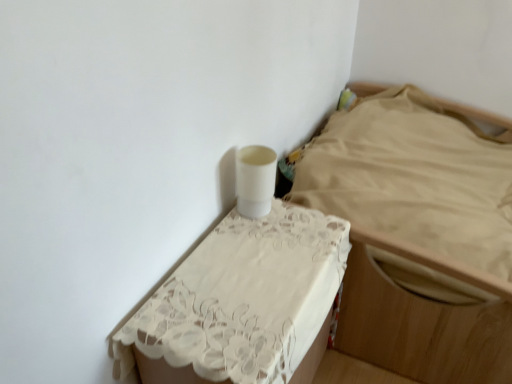
Question: Can you see white glossy nightstand at upper right, acting as the second furniture starting from the left, touching white lace tablecloth at upper center, which is counted as the 2th furniture, starting from the right?

Choices:
 (A) yes
 (B) no

Answer: (B)

Question: Does white glossy nightstand at upper right, acting as the second furniture starting from the left, have a smaller size compared to white lace tablecloth at upper center, positioned as the first furniture in left-to-right order?

Choices:
 (A) yes
 (B) no

Answer: (B)

Question: Does white glossy nightstand at upper right, acting as the second furniture starting from the left, have a lesser width compared to white lace tablecloth at upper center, positioned as the first furniture in left-to-right order?

Choices:
 (A) no
 (B) yes

Answer: (A)

Question: Is white lace tablecloth at upper center, positioned as the first furniture in left-to-right order, located within white glossy nightstand at upper right, acting as the second furniture starting from the left?

Choices:
 (A) yes
 (B) no

Answer: (B)

Question: Is white glossy nightstand at upper right, the first furniture viewed from the right, positioned in front of white lace tablecloth at upper center, which is counted as the 2th furniture, starting from the right?

Choices:
 (A) yes
 (B) no

Answer: (B)

Question: Is white glossy nightstand at upper right, acting as the second furniture starting from the left, behind white lace tablecloth at upper center, which is counted as the 2th furniture, starting from the right?

Choices:
 (A) yes
 (B) no

Answer: (A)

Question: Can you confirm if white lace tablecloth at upper center, which is counted as the 2th furniture, starting from the right, is smaller than white glossy nightstand at upper right, acting as the second furniture starting from the left?

Choices:
 (A) no
 (B) yes

Answer: (B)

Question: From the image's perspective, is white lace tablecloth at upper center, positioned as the first furniture in left-to-right order, on white glossy nightstand at upper right, acting as the second furniture starting from the left?

Choices:
 (A) yes
 (B) no

Answer: (B)

Question: Does white lace tablecloth at upper center, positioned as the first furniture in left-to-right order, have a lesser width compared to white glossy nightstand at upper right, the first furniture viewed from the right?

Choices:
 (A) yes
 (B) no

Answer: (A)

Question: From a real-world perspective, does white lace tablecloth at upper center, which is counted as the 2th furniture, starting from the right, sit lower than white glossy nightstand at upper right, acting as the second furniture starting from the left?

Choices:
 (A) yes
 (B) no

Answer: (A)

Question: Is white lace tablecloth at upper center, positioned as the first furniture in left-to-right order, behind white glossy nightstand at upper right, acting as the second furniture starting from the left?

Choices:
 (A) no
 (B) yes

Answer: (A)

Question: Is white lace tablecloth at upper center, which is counted as the 2th furniture, starting from the right, not within white glossy nightstand at upper right, acting as the second furniture starting from the left?

Choices:
 (A) no
 (B) yes

Answer: (B)

Question: Is white glossy nightstand at upper right, the first furniture viewed from the right, wider or thinner than white lace tablecloth at upper center, positioned as the first furniture in left-to-right order?

Choices:
 (A) wide
 (B) thin

Answer: (A)